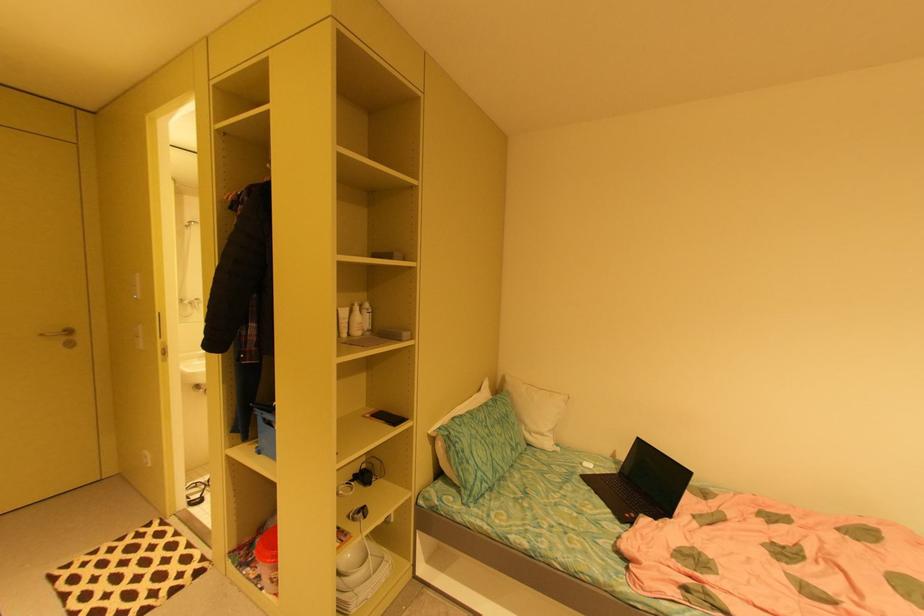
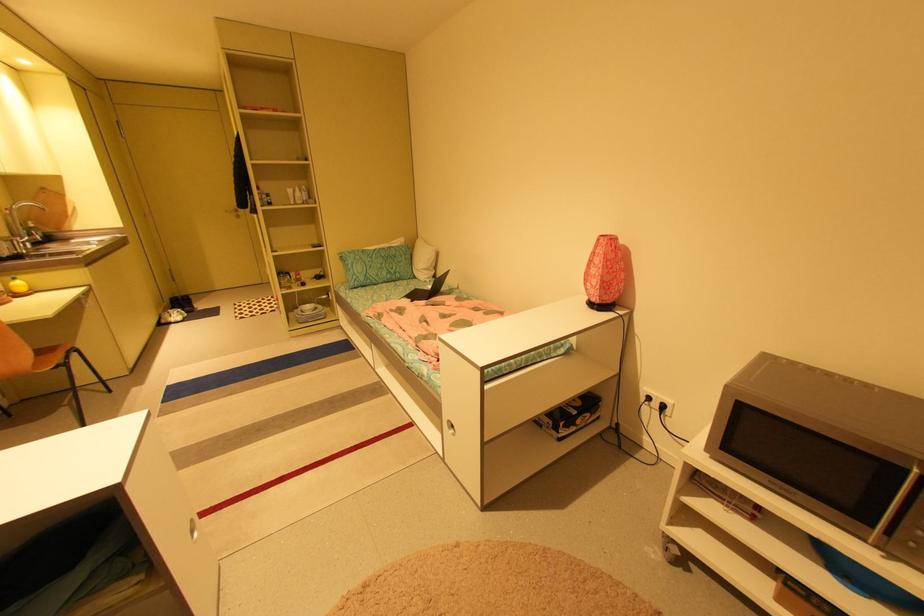
Find the pixel in the second image that matches (594,472) in the first image.

(431, 290)